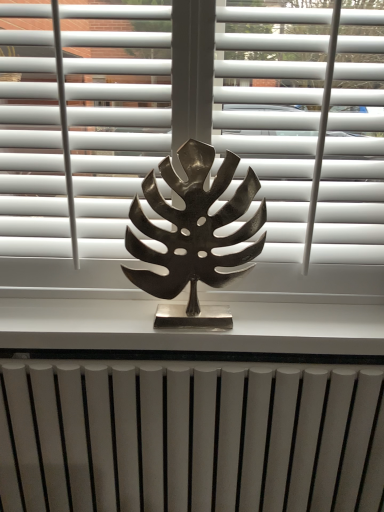
Locate an element on the screen. free spot above metallic silver at center (from a real-world perspective) is located at coordinates (198, 307).